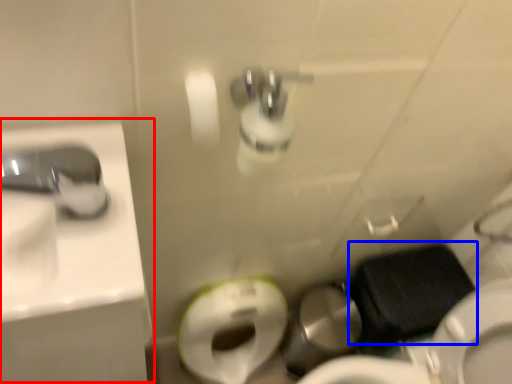
Question: Which object appears farthest to the camera in this image, sink (highlighted by a red box) or sit (highlighted by a blue box)?

Choices:
 (A) sink
 (B) sit

Answer: (B)